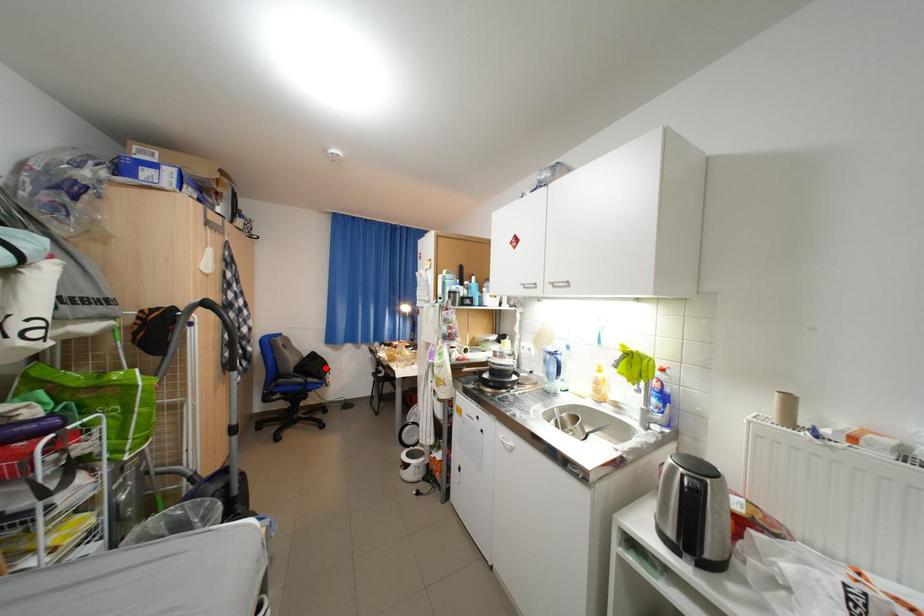
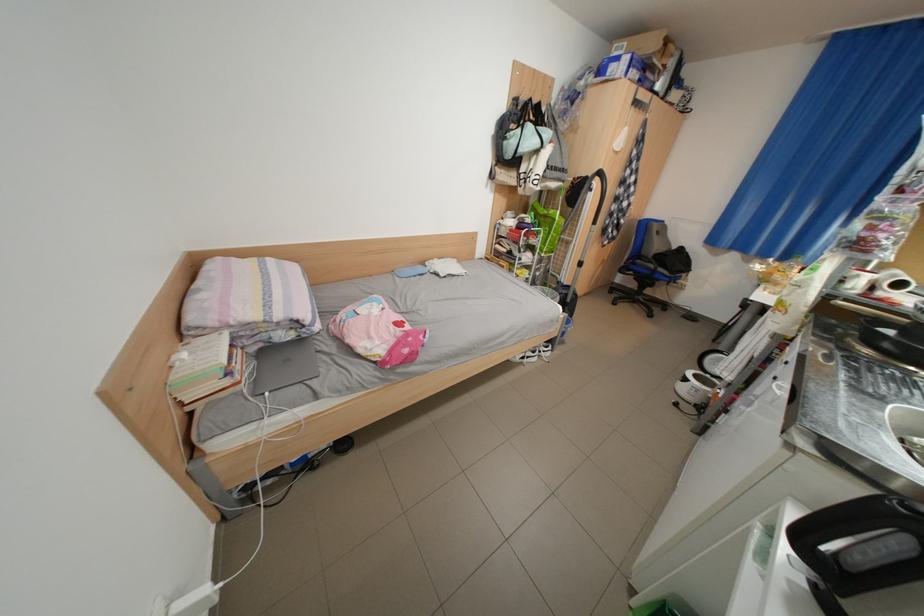
Question: I am providing you with two images of the same scene from different viewpoints. A red point is shown in image1. For the corresponding object point in image2, is it positioned nearer or farther from the camera?

Choices:
 (A) Nearer
 (B) Farther

Answer: (A)